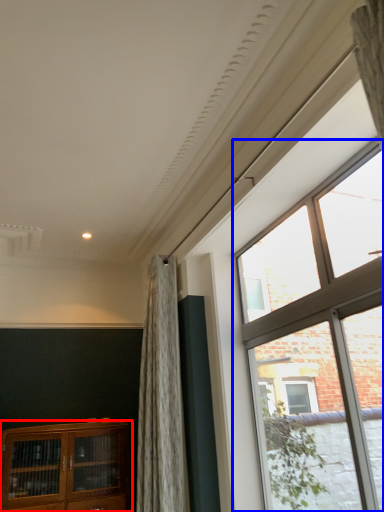
Question: Among these objects, which one is farthest to the camera, cabinetry (highlighted by a red box) or window (highlighted by a blue box)?

Choices:
 (A) cabinetry
 (B) window

Answer: (A)